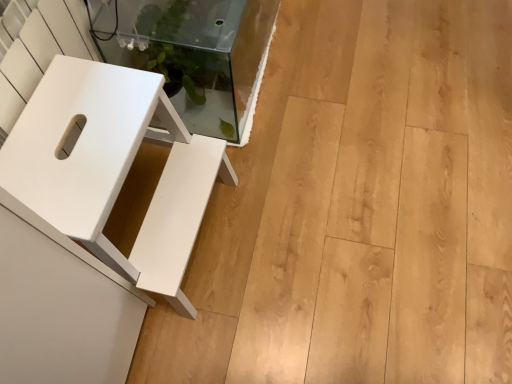
This screenshot has width=512, height=384. What are the coordinates of `vacant area that is in front of white matte stool at left` in the screenshot? It's located at (206, 345).